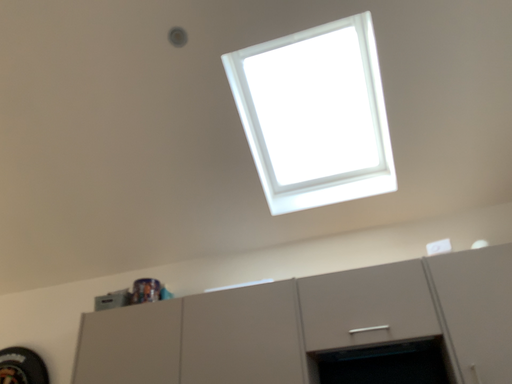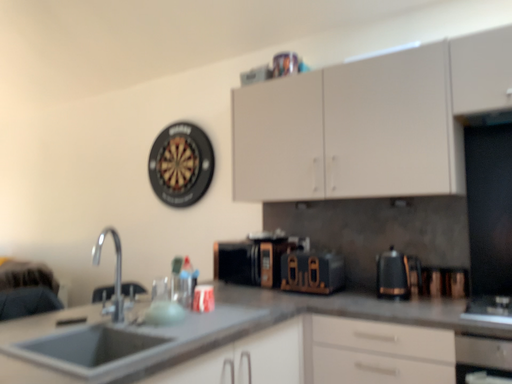
Question: Which way did the camera rotate in the video?

Choices:
 (A) rotated downward
 (B) rotated upward

Answer: (A)